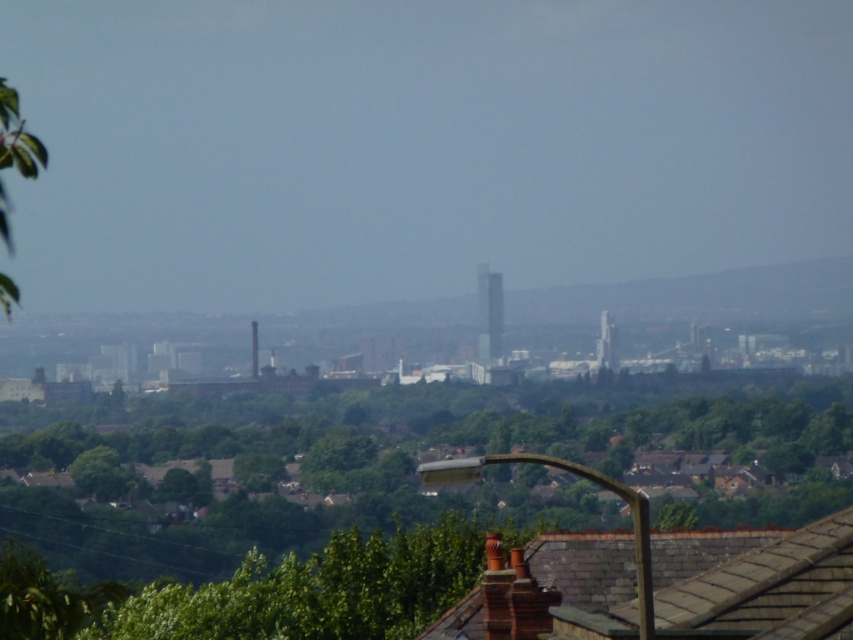
Question: Does green leafy tree at center appear on the right side of black glass chimney at center?

Choices:
 (A) yes
 (B) no

Answer: (B)

Question: Is green leafy tree at center positioned before black glass chimney at center?

Choices:
 (A) no
 (B) yes

Answer: (B)

Question: Among these points, which one is nearest to the camera?

Choices:
 (A) (331, 449)
 (B) (253, 374)
 (C) (13, 301)
 (D) (483, 346)

Answer: (C)

Question: Based on their relative distances, which object is farther from the green leafy tree at center?

Choices:
 (A) smooth brick chimney at center
 (B) green leafy tree at left
 (C) black glass chimney at center

Answer: (A)

Question: Which point is closer to the camera taking this photo?

Choices:
 (A) (254, 324)
 (B) (498, 342)
 (C) (13, 108)

Answer: (C)

Question: From the image, what is the correct spatial relationship of green leafy tree at center in relation to green leafy tree at left?

Choices:
 (A) right
 (B) left

Answer: (A)